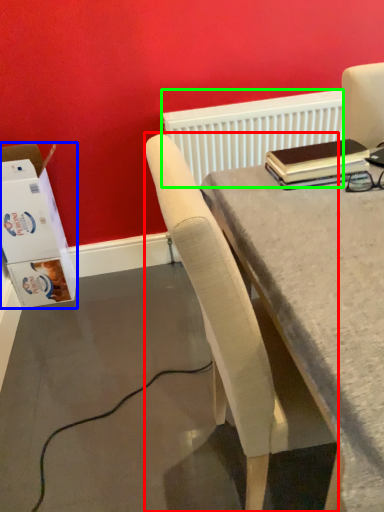
Question: Which is farther away from chair (highlighted by a red box)? box (highlighted by a blue box) or radiator (highlighted by a green box)?

Choices:
 (A) box
 (B) radiator

Answer: (A)